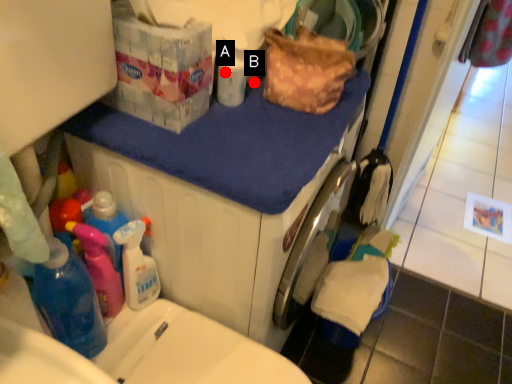
Question: Two points are circled on the image, labeled by A and B beside each circle. Among these points, which one is farthest from the camera?

Choices:
 (A) A is further
 (B) B is further

Answer: (B)